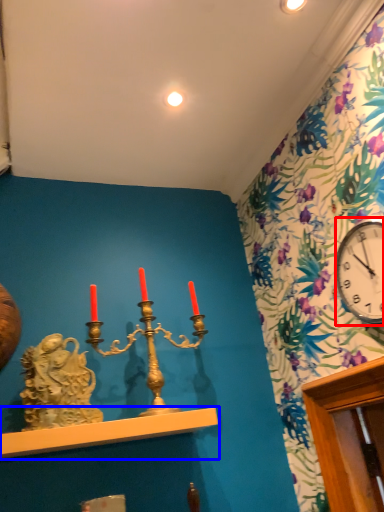
Question: Which point is closer to the camera, clock (highlighted by a red box) or shelf (highlighted by a blue box)?

Choices:
 (A) clock
 (B) shelf

Answer: (A)